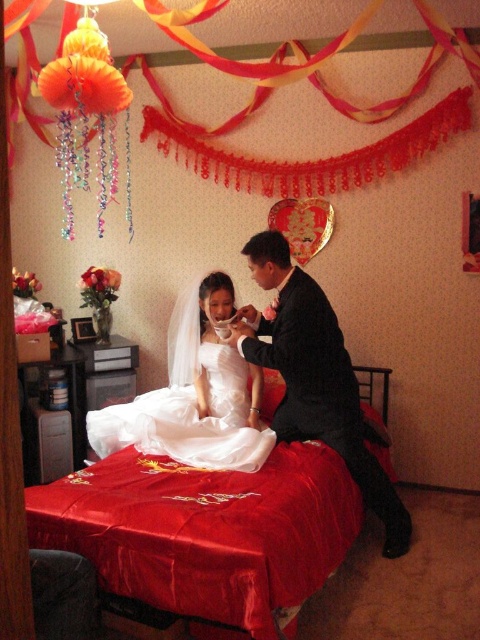
Is silky satin bed at center positioned before white satin dress at center?

Yes, it is in front of white satin dress at center.

Who is more distant from viewer, (223, 544) or (229, 291)?

Positioned behind is point (229, 291).

Is point (295, 600) behind point (165, 451)?

That is False.

The height and width of the screenshot is (640, 480). Identify the location of silky satin bed at center. (205, 531).

Does white satin dress at center lie in front of black marble chair at lower left?

No, white satin dress at center is behind black marble chair at lower left.

Between white satin dress at center and black marble chair at lower left, which one appears on the left side from the viewer's perspective?

From the viewer's perspective, black marble chair at lower left appears more on the left side.

What do you see at coordinates (193, 394) in the screenshot? I see `white satin dress at center` at bounding box center [193, 394].

You are a GUI agent. You are given a task and a screenshot of the screen. Output one action in this format:
    pyautogui.click(x=<x>, y=<y>)
    Task: Click on the white satin dress at center
    Image resolution: width=480 pixels, height=640 pixels.
    Given the screenshot: What is the action you would take?
    pyautogui.click(x=193, y=394)

Which is above, silky satin bed at center or black marble chair at lower left?

silky satin bed at center is higher up.

Is point (295, 525) positioned in front of point (78, 616)?

That is False.

Describe the element at coordinates (205, 531) in the screenshot. I see `silky satin bed at center` at that location.

This screenshot has width=480, height=640. In order to click on silky satin bed at center in this screenshot , I will do `click(205, 531)`.